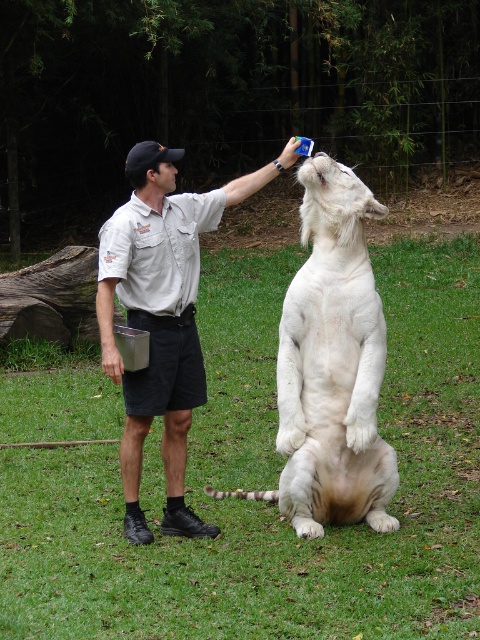
Is point (322, 308) behind point (103, 262)?

Yes, it is.

Looking at this image, which of these two, white fur tiger at center or light beige uniform at center, stands taller?

white fur tiger at center is taller.

You are a GUI agent. You are given a task and a screenshot of the screen. Output one action in this format:
    pyautogui.click(x=<x>, y=<y>)
    Task: Click on the white fur tiger at center
    The image size is (480, 640).
    Given the screenshot: What is the action you would take?
    pyautogui.click(x=332, y=365)